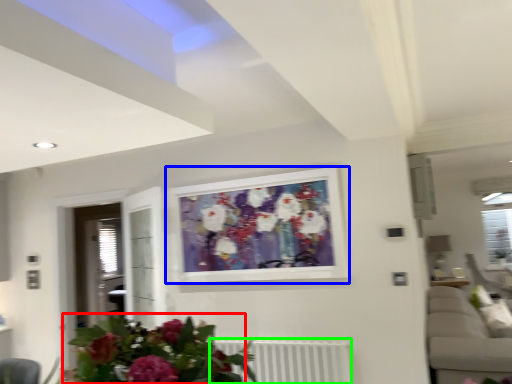
Question: Estimate the real-world distances between objects in this image. Which object is closer to floral arrangement (highlighted by a red box), picture frame (highlighted by a blue box) or radiator (highlighted by a green box)?

Choices:
 (A) picture frame
 (B) radiator

Answer: (B)